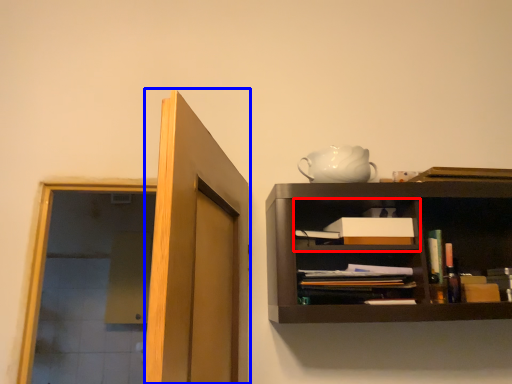
Question: Which of the following is the closest to the observer, cabinet (highlighted by a red box) or door (highlighted by a blue box)?

Choices:
 (A) cabinet
 (B) door

Answer: (B)